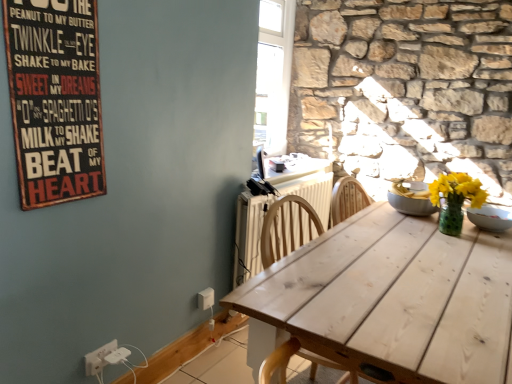
Describe the element at coordinates (98, 358) in the screenshot. I see `white plastic electric outlet at lower left, which is the 2th electric outlet in right-to-left order` at that location.

How much space does white plastic electric outlet at lower left, which ranks as the 1th electric outlet in bottom-to-top order, occupy vertically?

It is 8.84 centimeters.

In order to face white plastic electric outlet at lower center, which appears as the 1th electric outlet when viewed from the right, should I rotate leftwards or rightwards?

To align with it, rotate left about 6.557°.

The width and height of the screenshot is (512, 384). I want to click on white plastic electric outlet at lower center, the 2th electric outlet ordered from the bottom, so click(206, 298).

Measure the distance between point (89, 50) and camera.

Point (89, 50) and camera are 1.40 meters apart from each other.

Where is `white painted radiator at center`? white painted radiator at center is located at coordinates pyautogui.click(x=249, y=235).

Identify the location of white plastic electric outlet at lower left, which appears as the 1th electric outlet when viewed from the front. (98, 358).

From a real-world perspective, which is physically above, white wood table at center or white plastic electric outlet at lower center, the 2th electric outlet ordered from the bottom?

white wood table at center, from a real-world perspective.

Looking at this image, is white wood table at center taller or shorter than white plastic electric outlet at lower center, the 2th electric outlet ordered from the bottom?

In the image, white wood table at center appears to be taller than white plastic electric outlet at lower center, the 2th electric outlet ordered from the bottom.

Which is more distant, [461,349] or [209,287]?

The point [209,287] is behind.

Is white plastic electric outlet at lower left, which ranks as the 1th electric outlet in bottom-to-top order, spatially inside white wood table at center, or outside of it?

white plastic electric outlet at lower left, which ranks as the 1th electric outlet in bottom-to-top order, is located beyond the bounds of white wood table at center.

Visually, is white plastic electric outlet at lower left, which is the 2th electric outlet in right-to-left order, positioned to the left or to the right of white wood table at center?

Clearly, white plastic electric outlet at lower left, which is the 2th electric outlet in right-to-left order, is on the left of white wood table at center in the image.

Is white plastic electric outlet at lower left, which is counted as the first electric outlet, starting from the left, in front of or behind white wood table at center in the image?

white plastic electric outlet at lower left, which is counted as the first electric outlet, starting from the left, is behind white wood table at center.

Considering the points (105, 363) and (503, 380), which point is behind, point (105, 363) or point (503, 380)?

The point (105, 363) is behind.

Is white painted radiator at center wider than white plastic electric outlet at lower center, the 2th electric outlet ordered from the bottom?

Yes, white painted radiator at center is wider than white plastic electric outlet at lower center, the 2th electric outlet ordered from the bottom.

Between white painted radiator at center and white plastic electric outlet at lower center, the 2th electric outlet ordered from the bottom, which one is positioned behind?

white plastic electric outlet at lower center, the 2th electric outlet ordered from the bottom.

From the image's perspective, does white painted radiator at center appear higher than white plastic electric outlet at lower center, which is the first electric outlet in back-to-front order?

Indeed, from the image's perspective, white painted radiator at center is shown above white plastic electric outlet at lower center, which is the first electric outlet in back-to-front order.

Is white plastic electric outlet at lower center, the 2th electric outlet ordered from the bottom, not near white plastic electric outlet at lower left, which is the 2th electric outlet in right-to-left order?

white plastic electric outlet at lower center, the 2th electric outlet ordered from the bottom, is actually quite close to white plastic electric outlet at lower left, which is the 2th electric outlet in right-to-left order.

Considering the sizes of objects white plastic electric outlet at lower center, the second electric outlet from the left, and white plastic electric outlet at lower left, the 2th electric outlet in the back-to-front sequence, in the image provided, who is thinner, white plastic electric outlet at lower center, the second electric outlet from the left, or white plastic electric outlet at lower left, the 2th electric outlet in the back-to-front sequence,?

With smaller width is white plastic electric outlet at lower left, the 2th electric outlet in the back-to-front sequence.

Considering the positions of objects white plastic electric outlet at lower center, which appears as the 1th electric outlet when viewed from the right, and white plastic electric outlet at lower left, which appears as the 1th electric outlet when viewed from the front, in the image provided, who is more to the left, white plastic electric outlet at lower center, which appears as the 1th electric outlet when viewed from the right, or white plastic electric outlet at lower left, which appears as the 1th electric outlet when viewed from the front,?

From the viewer's perspective, white plastic electric outlet at lower left, which appears as the 1th electric outlet when viewed from the front, appears more on the left side.

This screenshot has height=384, width=512. In the image, there is a white wood table at center. Identify the location of radiator above it (from the image's perspective). (249, 235).

Which is behind, point (396, 321) or point (319, 175)?

Point (319, 175)

From the image's perspective, is white wood table at center positioned above or below white painted radiator at center?

white wood table at center is below white painted radiator at center.

Is white wood table at center outside of white painted radiator at center?

Absolutely, white wood table at center is external to white painted radiator at center.

Does wooden signboard at upper left lie behind white painted radiator at center?

That is False.

Considering the sizes of objects wooden signboard at upper left and white painted radiator at center in the image provided, who is bigger, wooden signboard at upper left or white painted radiator at center?

With larger size is white painted radiator at center.

Is white painted radiator at center at the back of wooden signboard at upper left?

wooden signboard at upper left is not turned away from white painted radiator at center.

Is point (51, 90) positioned behind point (238, 236)?

That is False.

Is white glossy bowl at upper right thinner than white painted radiator at center?

In fact, white glossy bowl at upper right might be wider than white painted radiator at center.

From a real-world perspective, which object stands above the other?

white glossy bowl at upper right is physically above.

Find the location of a particular element. This screenshot has height=384, width=512. bowl above the white painted radiator at center (from the image's perspective) is located at coordinates click(490, 218).

Is white glossy bowl at upper right far away from white painted radiator at center?

That's right, there is a large distance between white glossy bowl at upper right and white painted radiator at center.

The height and width of the screenshot is (384, 512). Find the location of `the 1st electric outlet below the white wood table at center (from the image's perspective)`. the 1st electric outlet below the white wood table at center (from the image's perspective) is located at coordinates (206, 298).

Locate an element on the screen. table located above the white plastic electric outlet at lower left, the 2th electric outlet in the back-to-front sequence (from a real-world perspective) is located at coordinates (394, 297).

Which object lies nearer to the anchor point white wood table at center, white glossy bowl at upper right or wooden signboard at upper left?

white glossy bowl at upper right is closer to white wood table at center.

From the image, which object appears to be nearer to white plastic electric outlet at lower left, placed as the 2th electric outlet when sorted from top to bottom, wooden signboard at upper left or white painted radiator at center?

Based on the image, wooden signboard at upper left appears to be nearer to white plastic electric outlet at lower left, placed as the 2th electric outlet when sorted from top to bottom.

Which object lies nearer to the anchor point white plastic electric outlet at lower left, which is counted as the first electric outlet, starting from the left, white plastic electric outlet at lower center, the second electric outlet from the left, or white painted radiator at center?

Based on the image, white plastic electric outlet at lower center, the second electric outlet from the left, appears to be nearer to white plastic electric outlet at lower left, which is counted as the first electric outlet, starting from the left.

Estimate the real-world distances between objects in this image. Which object is closer to white wood table at center, white painted radiator at center or white glossy bowl at upper right?

The object closer to white wood table at center is white glossy bowl at upper right.

Considering their positions, is white plastic electric outlet at lower left, which is the 2th electric outlet in right-to-left order, positioned closer to white painted radiator at center than white glossy bowl at upper right?

white glossy bowl at upper right is closer to white painted radiator at center.

When comparing their distances from white plastic electric outlet at lower center, which appears as the 1th electric outlet when viewed from the right, does white glossy bowl at upper right or white plastic electric outlet at lower left, which ranks as the 1th electric outlet in bottom-to-top order, seem further?

The object further to white plastic electric outlet at lower center, which appears as the 1th electric outlet when viewed from the right, is white glossy bowl at upper right.

Looking at the image, which one is located closer to white painted radiator at center, wooden signboard at upper left or white plastic electric outlet at lower center, which is counted as the 2th electric outlet, starting from the front?

Based on the image, white plastic electric outlet at lower center, which is counted as the 2th electric outlet, starting from the front, appears to be nearer to white painted radiator at center.

When comparing their distances from white plastic electric outlet at lower center, the 1th electric outlet in the top-to-bottom sequence, does white painted radiator at center or wooden signboard at upper left seem further?

wooden signboard at upper left.

What are the coordinates of `table between white plastic electric outlet at lower left, which appears as the 1th electric outlet when viewed from the front, and white glossy bowl at upper right, in the horizontal direction` in the screenshot? It's located at (394, 297).

This screenshot has height=384, width=512. Find the location of `radiator located between white plastic electric outlet at lower left, which is counted as the first electric outlet, starting from the left, and white glossy bowl at upper right in the left-right direction`. radiator located between white plastic electric outlet at lower left, which is counted as the first electric outlet, starting from the left, and white glossy bowl at upper right in the left-right direction is located at coordinates (249, 235).

The height and width of the screenshot is (384, 512). Identify the location of radiator situated between white plastic electric outlet at lower left, which is the 2th electric outlet in right-to-left order, and white wood table at center from left to right. (249, 235).

In order to click on electric outlet situated between white plastic electric outlet at lower left, placed as the 2th electric outlet when sorted from top to bottom, and white glossy bowl at upper right from left to right in this screenshot , I will do `click(206, 298)`.